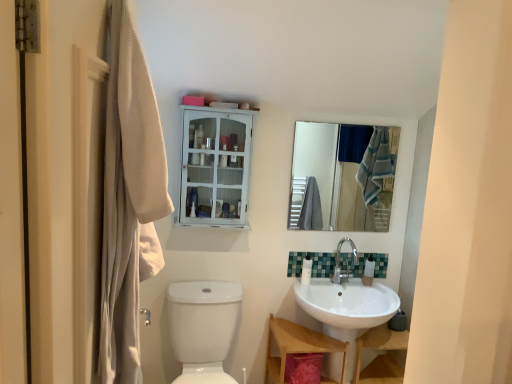
Question: Based on their positions, is white glossy bottle at right, which ranks as the 2th toiletry in left-to-right order, located to the left or right of white glossy toilet bowl at lower left?

Choices:
 (A) left
 (B) right

Answer: (B)

Question: From the image's perspective, is white glossy bottle at right, which ranks as the 2th toiletry in left-to-right order, located above or below white glossy toilet bowl at lower left?

Choices:
 (A) above
 (B) below

Answer: (A)

Question: Based on their relative distances, which object is nearer to the wooden vanity at lower center?

Choices:
 (A) green mosaic tile at center
 (B) white glossy bottle at right, marked as the 1th toiletry in a right-to-left arrangement
 (C) white glossy bottle at lower center, marked as the first toiletry in a left-to-right arrangement
 (D) white glossy sink at lower right
 (E) white wooden cabinet at upper center

Answer: (D)

Question: Based on their relative distances, which object is farther from the white glossy sink at lower right?

Choices:
 (A) green mosaic tile at center
 (B) clear glass mirror at upper center
 (C) white glossy bottle at right, marked as the 1th toiletry in a right-to-left arrangement
 (D) beige textured robe at left
 (E) white wooden cabinet at upper center

Answer: (D)